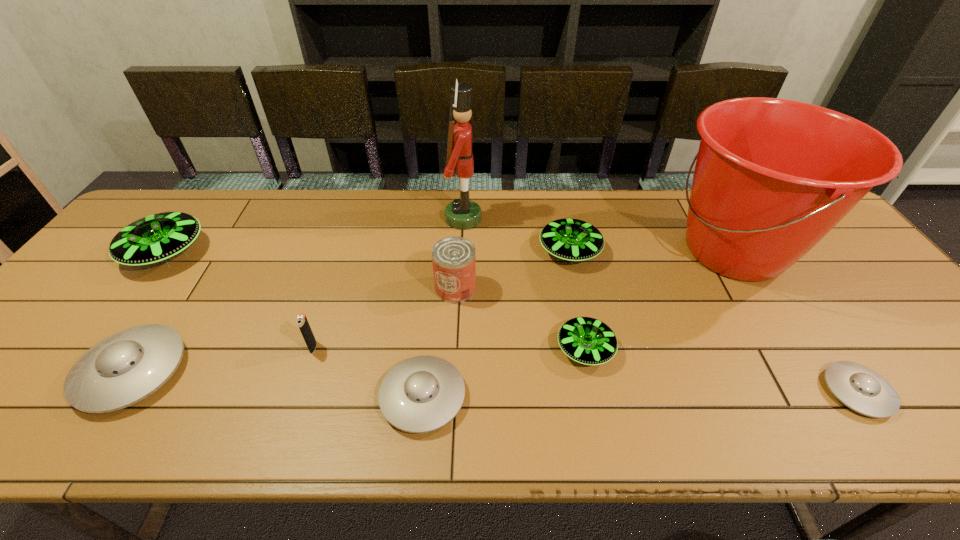
Identify which saucer is the fourth closest to the nearest green saucer. Please provide its 2D coordinates. Your answer should be formatted as a tuple, i.e. [(x, y)], where the tuple contains the x and y coordinates of a point satisfying the conditions above.

[(126, 367)]

Find the location of a particular element. saucer that can be found as the fifth closest to the leftmost gray saucer is located at coordinates (860, 388).

Identify the location of the second closest green saucer to the second biggest green saucer. (156, 238).

Image resolution: width=960 pixels, height=540 pixels. I want to click on green saucer that stands as the third closest to the can, so click(x=156, y=238).

Identify which gray saucer is located as the nearest to the tallest saucer. Please provide its 2D coordinates. Your answer should be formatted as a tuple, i.e. [(x, y)], where the tuple contains the x and y coordinates of a point satisfying the conditions above.

[(126, 367)]

Identify the location of gray saucer that is the second nearest to the second biggest gray saucer. This screenshot has width=960, height=540. (860, 388).

Locate an element on the screen. This screenshot has height=540, width=960. free space that satisfies the following two spatial constraints: 1. on the front-facing side of the green nutcracker; 2. on the right side of the shortest saucer is located at coordinates (456, 392).

Identify the location of vacant region that satisfies the following two spatial constraints: 1. with the handle attached to the rim of the second tallest object; 2. on the back side of the smallest gray saucer. The width and height of the screenshot is (960, 540). (820, 392).

Locate an element on the screen. vacant space that satisfies the following two spatial constraints: 1. with the handle attached to the rim of the red bucket; 2. on the front side of the second biggest gray saucer is located at coordinates (823, 397).